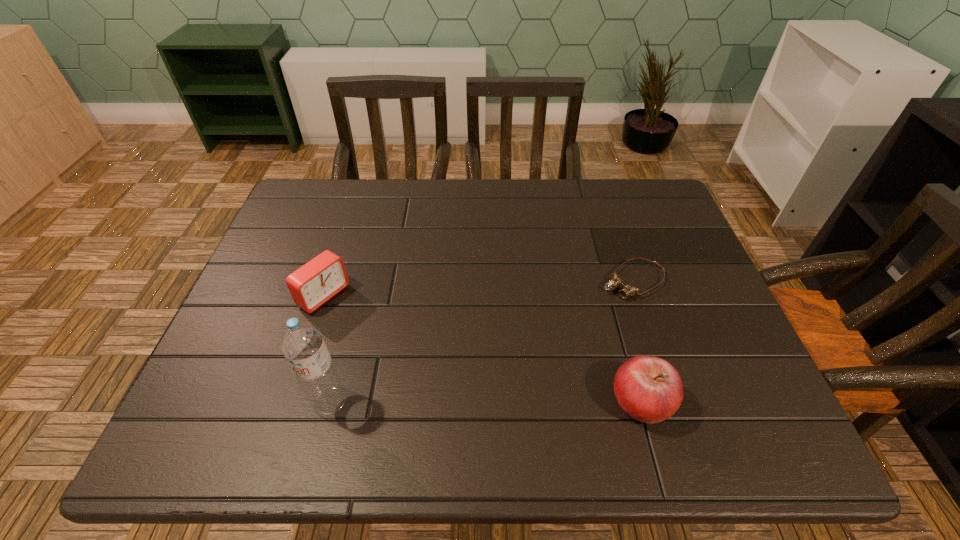
Where is `free space located 0.300m on the front lenses and sides of the goggles`? This screenshot has height=540, width=960. free space located 0.300m on the front lenses and sides of the goggles is located at coordinates (518, 359).

Image resolution: width=960 pixels, height=540 pixels. I want to click on vacant space located 0.280m on the front lenses and sides of the goggles, so click(525, 354).

Where is `water bottle that is positioned at the near edge`? The image size is (960, 540). water bottle that is positioned at the near edge is located at coordinates (301, 342).

The image size is (960, 540). Find the location of `apple present at the near edge`. apple present at the near edge is located at coordinates (649, 389).

At what (x,y) coordinates should I click in order to perform the action: click on object that is at the left edge. Please return your answer as a coordinate pair (x, y). The width and height of the screenshot is (960, 540). Looking at the image, I should click on (313, 284).

In order to click on object located at the right edge in this screenshot , I will do `click(628, 290)`.

Locate an element on the screen. The height and width of the screenshot is (540, 960). vacant region at the far edge of the desktop is located at coordinates (358, 227).

The image size is (960, 540). Identify the location of vacant space at the left edge of the desktop. (275, 325).

The image size is (960, 540). Identify the location of vacant space at the right edge of the desktop. (732, 359).

Image resolution: width=960 pixels, height=540 pixels. I want to click on vacant space at the far left corner of the desktop, so click(x=287, y=210).